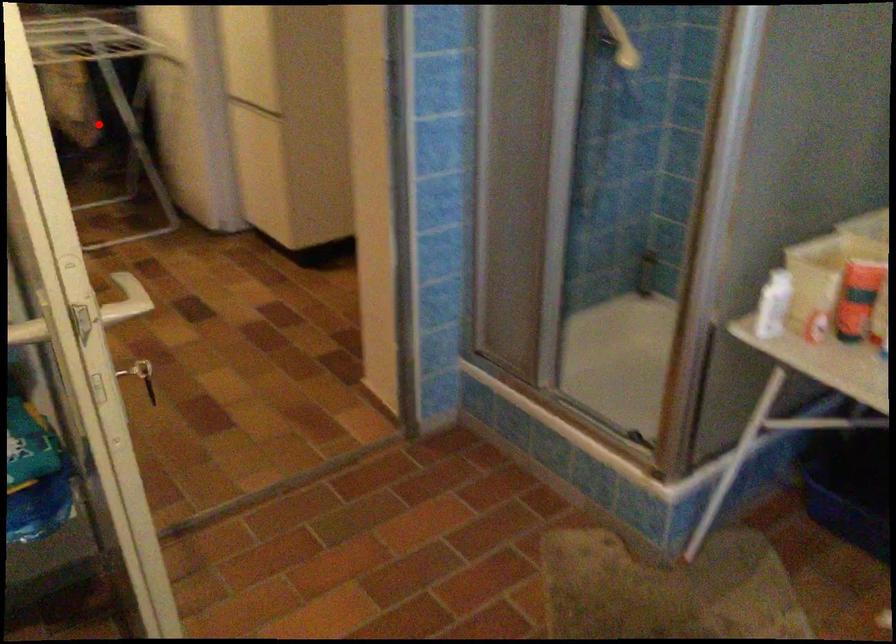
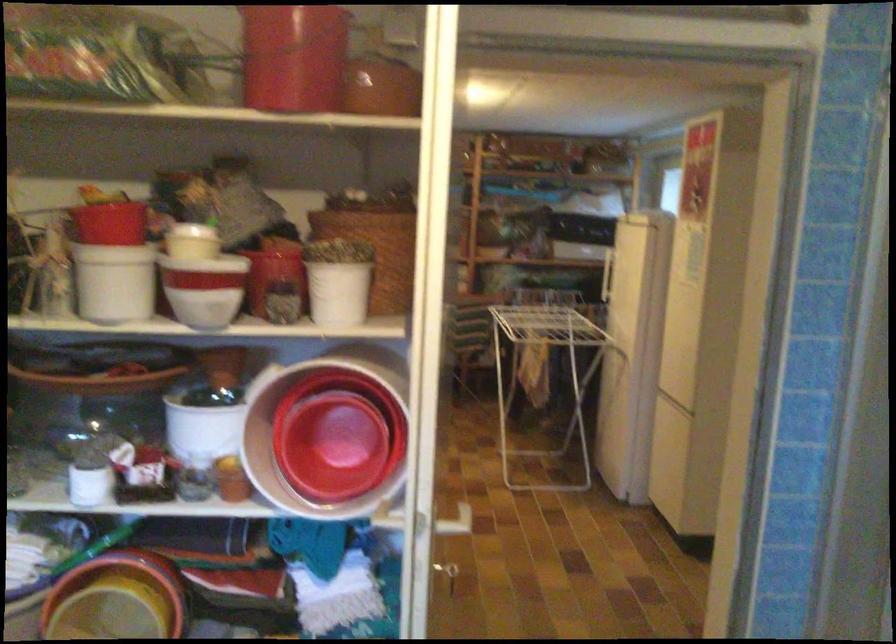
Question: I am providing you with two images of the same scene from different viewpoints. In image1, a red point is highlighted. Considering the same 3D point in image2, which of the following is correct?

Choices:
 (A) It is closer
 (B) It is farther

Answer: (B)